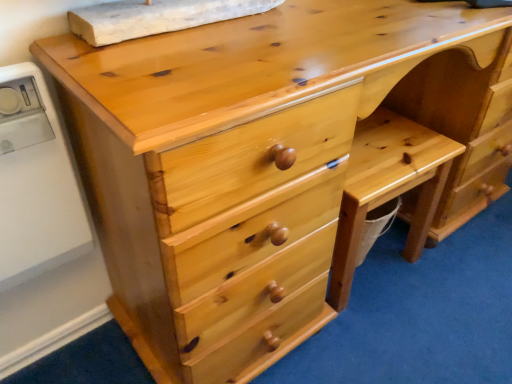
Question: Considering the relative positions of natural wood chair at lower right and white plastic appliance at left in the image provided, is natural wood chair at lower right to the left or to the right of white plastic appliance at left?

Choices:
 (A) left
 (B) right

Answer: (B)

Question: Considering their positions, is natural wood chair at lower right located in front of or behind white plastic appliance at left?

Choices:
 (A) behind
 (B) front

Answer: (A)

Question: Considering the positions of point (352, 208) and point (31, 221), is point (352, 208) closer or farther from the camera than point (31, 221)?

Choices:
 (A) closer
 (B) farther

Answer: (B)

Question: Is white plastic appliance at left situated inside natural wood chair at lower right or outside?

Choices:
 (A) outside
 (B) inside

Answer: (A)

Question: In terms of width, does white plastic appliance at left look wider or thinner when compared to natural wood chair at lower right?

Choices:
 (A) thin
 (B) wide

Answer: (A)

Question: In the image, is white plastic appliance at left positioned in front of or behind natural wood chair at lower right?

Choices:
 (A) behind
 (B) front

Answer: (B)

Question: Considering the positions of point (84, 251) and point (415, 233), is point (84, 251) closer or farther from the camera than point (415, 233)?

Choices:
 (A) closer
 (B) farther

Answer: (A)